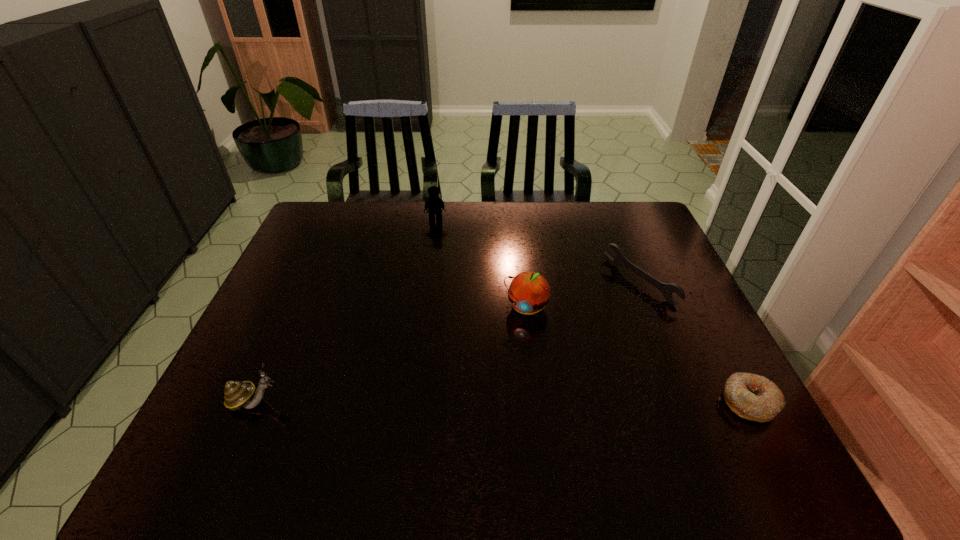
Where is `the fourth closest object to the farthest object`? This screenshot has width=960, height=540. the fourth closest object to the farthest object is located at coordinates (753, 397).

At what (x,y) coordinates should I click in order to perform the action: click on object that stands as the closest to the snail. Please return your answer as a coordinate pair (x, y). Image resolution: width=960 pixels, height=540 pixels. Looking at the image, I should click on (529, 292).